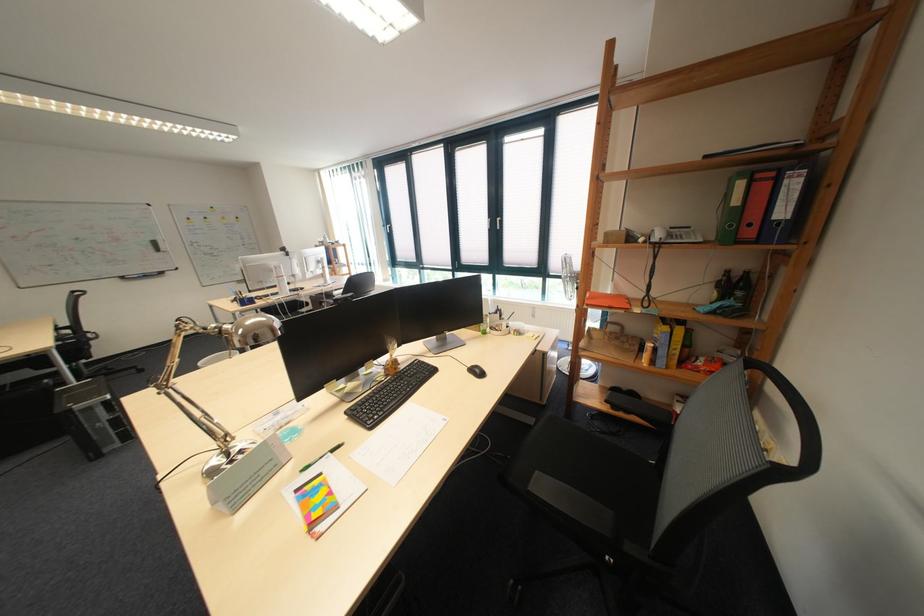
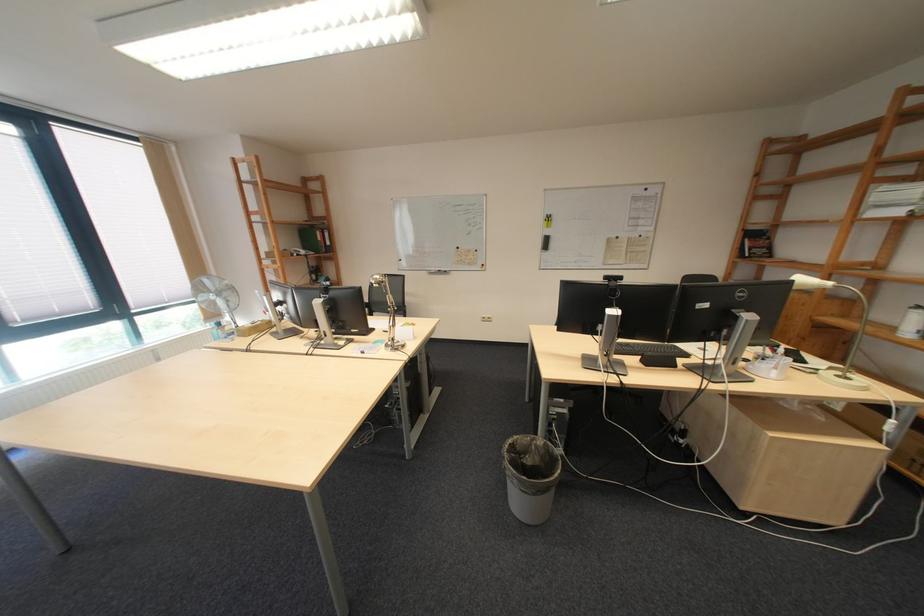
Locate, in the second image, the point that corresponds to the point at 730,296 in the first image.

(329, 278)